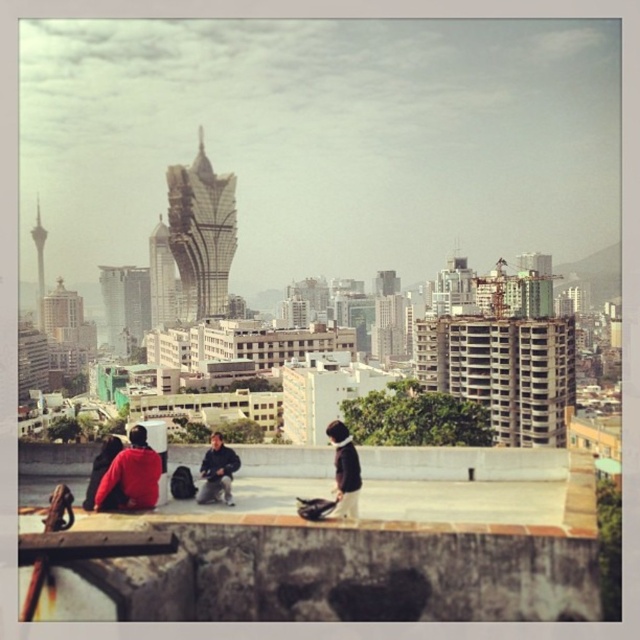
You are a city planner assessing the view from the concrete ledge where the red matte jacket at lower left is sitting. You need to determine if the silver metallic tower at center will block the view of the park located behind it. Can you confirm if the tower is wider than the jacket?

The silver metallic tower at center might be wider than red matte jacket at lower left, so there is a possibility that the tower could block the view of the park behind it depending on its exact width and positioning.

You are standing at the concrete ledge in the cityscape image. There are two points marked in the scene. The first point is at coordinates point (180,182) and the second point is at point (221,467). Which of these two points is closer to you?

Point (180,182) is closer to you because it is further to the viewer than point (221,467).